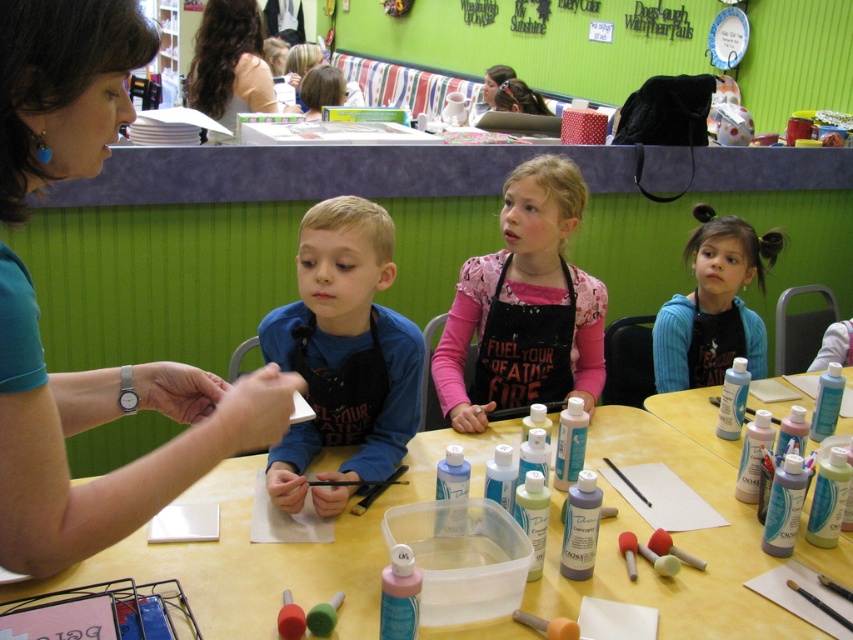
Question: Is matte teal shirt at upper left thinner than brown hair at upper left?

Choices:
 (A) no
 (B) yes

Answer: (B)

Question: Is pink matte apron at center smaller than brown hair at upper left?

Choices:
 (A) no
 (B) yes

Answer: (B)

Question: Which point appears farthest from the camera in this image?

Choices:
 (A) pos(376,385)
 (B) pos(209,486)

Answer: (A)

Question: Which point appears closest to the camera in this image?

Choices:
 (A) (770, 250)
 (B) (259, 40)
 (C) (708, 413)
 (D) (735, 464)

Answer: (D)

Question: Which of the following is the closest to the observer?

Choices:
 (A) (717, 477)
 (B) (201, 97)

Answer: (A)

Question: Is pink matte apron at center below translucent plastic bottles at center?

Choices:
 (A) yes
 (B) no

Answer: (B)